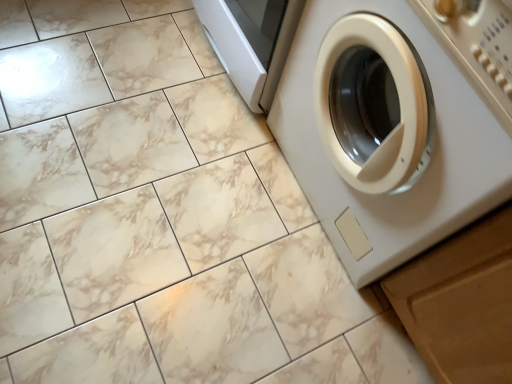
Question: Is white glossy washing machine at right situated inside wooden drawer at lower right or outside?

Choices:
 (A) inside
 (B) outside

Answer: (B)

Question: Visually, is white glossy washing machine at right positioned to the left or to the right of wooden drawer at lower right?

Choices:
 (A) right
 (B) left

Answer: (B)

Question: From the image's perspective, relative to wooden drawer at lower right, is white glossy washing machine at right above or below?

Choices:
 (A) below
 (B) above

Answer: (B)

Question: Which is correct: wooden drawer at lower right is inside white glossy washing machine at right, or outside of it?

Choices:
 (A) inside
 (B) outside

Answer: (B)

Question: From the image's perspective, is wooden drawer at lower right located above or below white glossy washing machine at right?

Choices:
 (A) below
 (B) above

Answer: (A)

Question: Is wooden drawer at lower right to the left or to the right of white glossy washing machine at right in the image?

Choices:
 (A) right
 (B) left

Answer: (A)

Question: Is wooden drawer at lower right bigger or smaller than white glossy washing machine at right?

Choices:
 (A) big
 (B) small

Answer: (B)